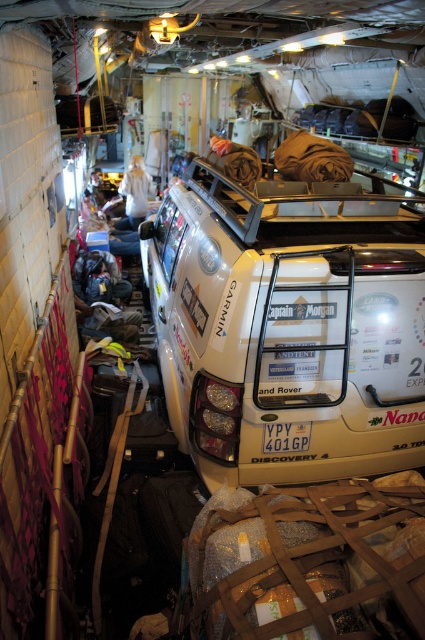
Is white matte suv at center taller than white plastic license plate at center?

Indeed, white matte suv at center has a greater height compared to white plastic license plate at center.

This screenshot has height=640, width=425. I want to click on white matte suv at center, so click(288, 326).